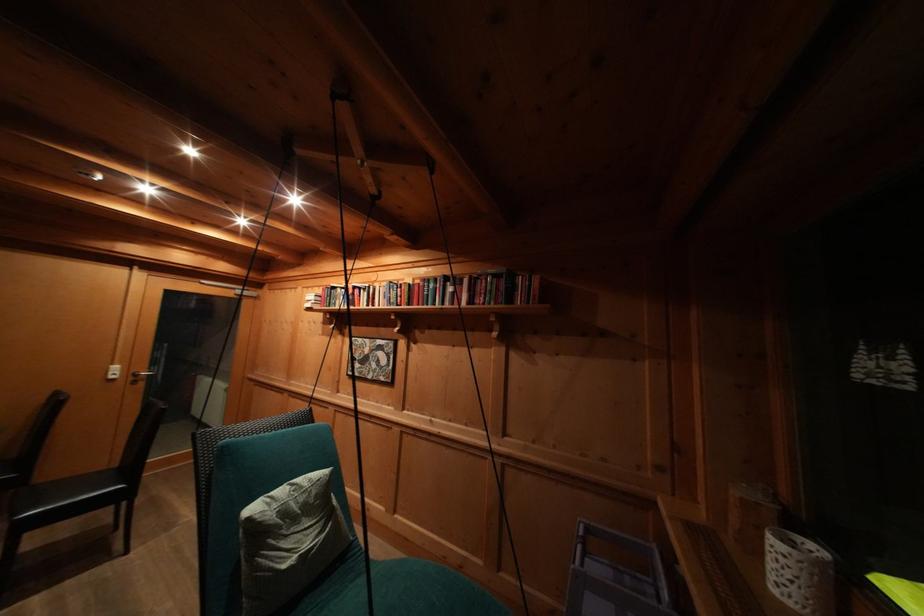
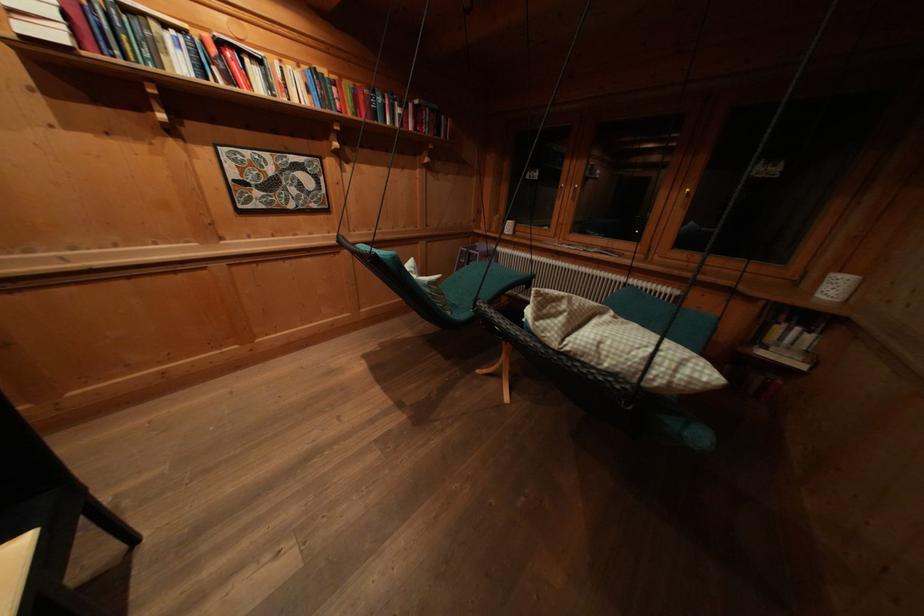
Find the pixel in the second image that matches pixel 438 291 in the first image.

(385, 103)